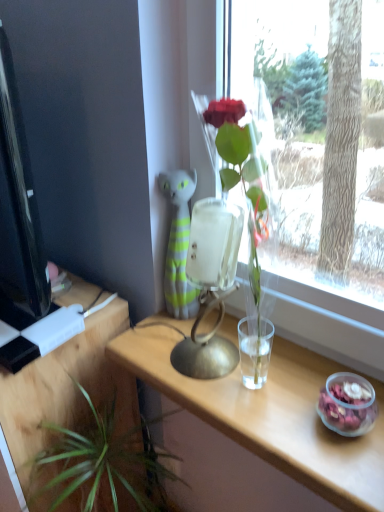
The height and width of the screenshot is (512, 384). I want to click on vacant area to the left of metallic gold table lamp at center, so click(x=148, y=362).